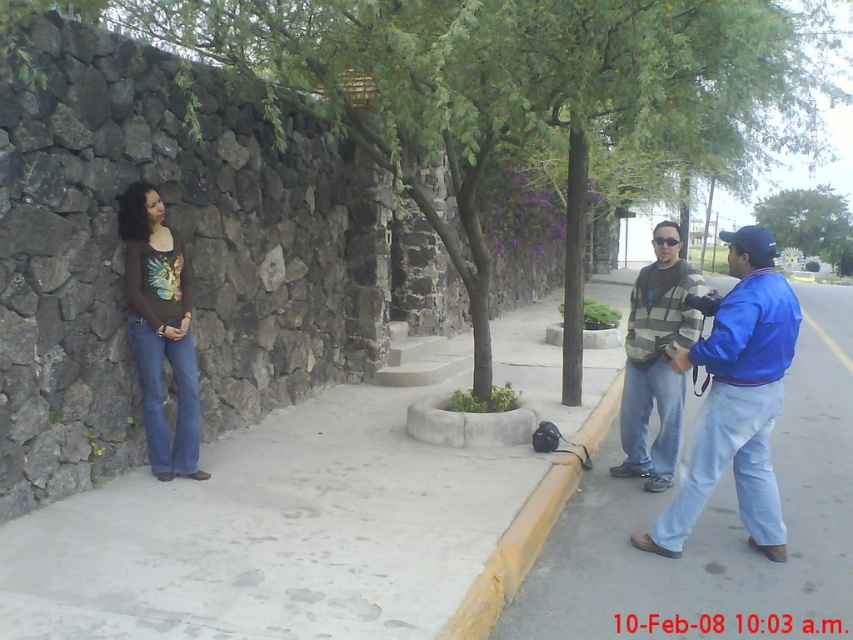
Question: Does striped knit sweater at center appear under green leafy tree at upper center?

Choices:
 (A) no
 (B) yes

Answer: (B)

Question: Which object appears farthest from the camera in this image?

Choices:
 (A) striped knit sweater at center
 (B) striped sweater at right

Answer: (B)

Question: Does blue jeans at right have a smaller size compared to matte brown shirt at left?

Choices:
 (A) yes
 (B) no

Answer: (B)

Question: Which point appears farthest from the camera in this image?

Choices:
 (A) (160, 259)
 (B) (761, 81)
 (C) (689, 445)

Answer: (B)

Question: Is green leafy tree at center above yellow painted concrete curb at lower center?

Choices:
 (A) no
 (B) yes

Answer: (B)

Question: Which point is farther from the camera taking this photo?

Choices:
 (A) (126, 291)
 (B) (712, 499)
 (C) (672, 432)

Answer: (C)